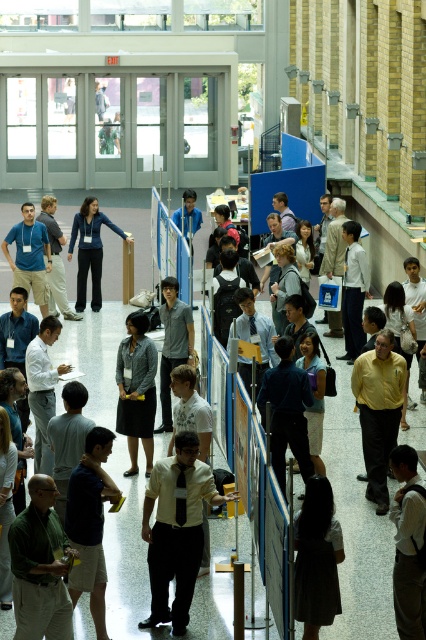
Question: Is gray fabric skirt at center thinner than matte blue jacket at center?

Choices:
 (A) no
 (B) yes

Answer: (B)

Question: Does gray fabric skirt at center have a larger size compared to matte blue jacket at center?

Choices:
 (A) yes
 (B) no

Answer: (B)

Question: Which point is closer to the camera?

Choices:
 (A) matte blue jacket at center
 (B) gray fabric skirt at center

Answer: (B)

Question: Which point is closer to the camera taking this photo?

Choices:
 (A) (95, 252)
 (B) (135, 392)

Answer: (B)

Question: Does gray fabric skirt at center have a greater width compared to matte blue jacket at center?

Choices:
 (A) no
 (B) yes

Answer: (A)

Question: Among these points, which one is nearest to the camera?

Choices:
 (A) (95, 218)
 (B) (135, 429)

Answer: (B)